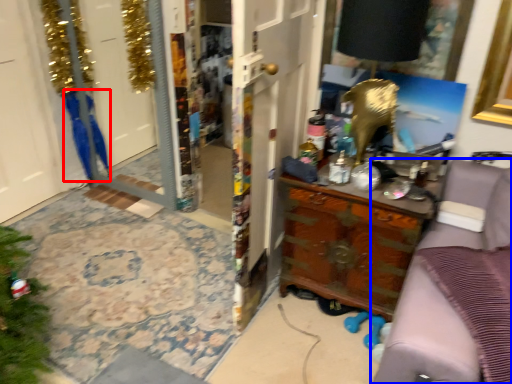
Question: Among these objects, which one is farthest to the camera, robe (highlighted by a red box) or furniture (highlighted by a blue box)?

Choices:
 (A) robe
 (B) furniture

Answer: (A)